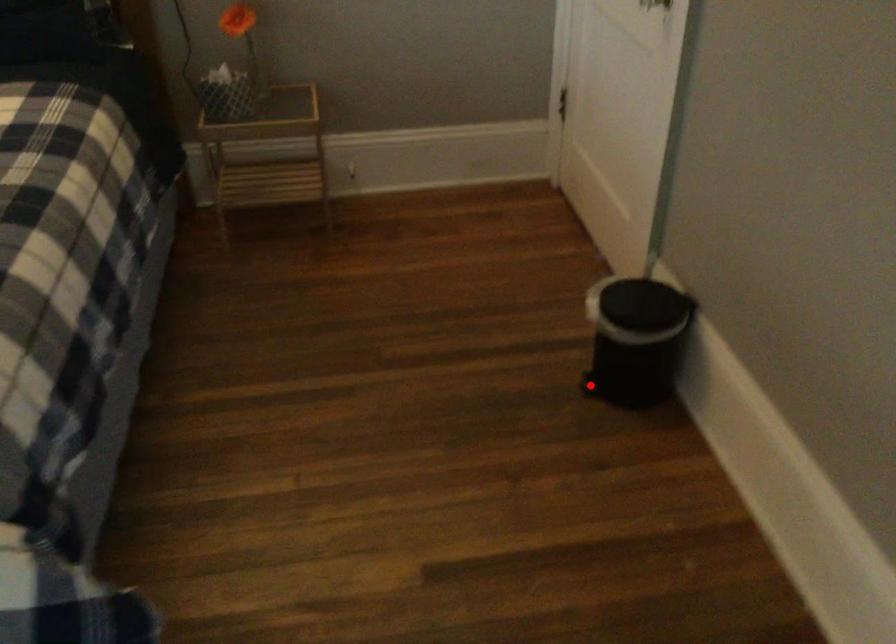
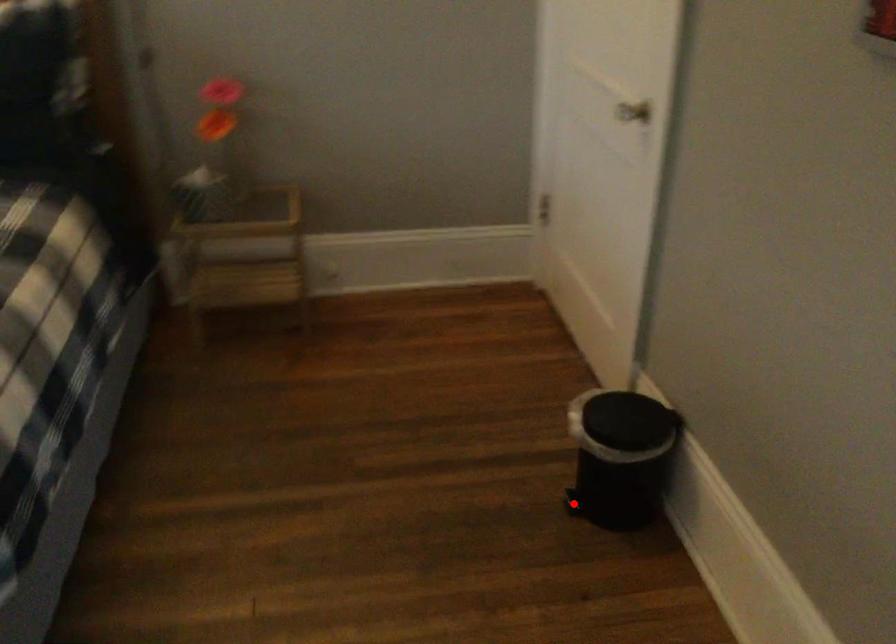
I am providing you with two images of the same scene from different viewpoints. A red point is marked on the first image and another point is marked on the second image. Is the marked point in image1 the same physical position as the marked point in image2?

Yes